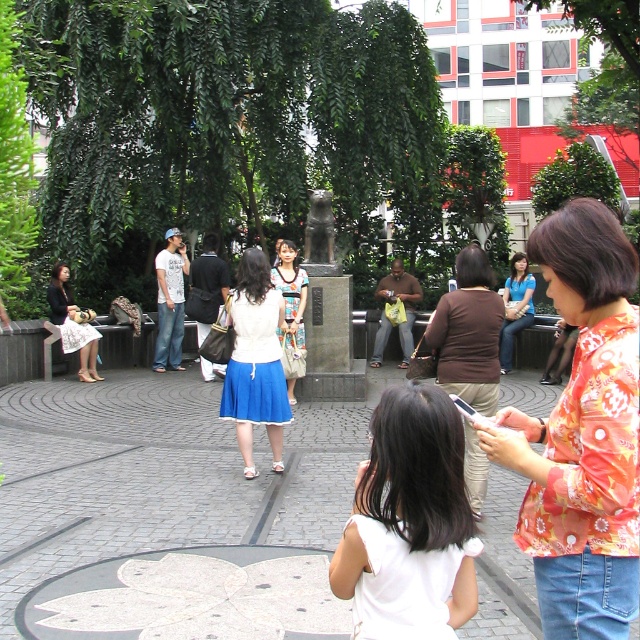
Based on the scene description, where is the white fabric dress at center located in terms of its 2D coordinates?

The white fabric dress at center is located at the 2D coordinates point [410,522].

You are a photographer trying to capture a candid shot of the white fabric dress at center and the brown fabric skirt at center in the plaza scene. Based on their positions, which one is positioned lower in the frame?

The white fabric dress at center is located below the brown fabric skirt at center, so it is positioned lower in the frame.